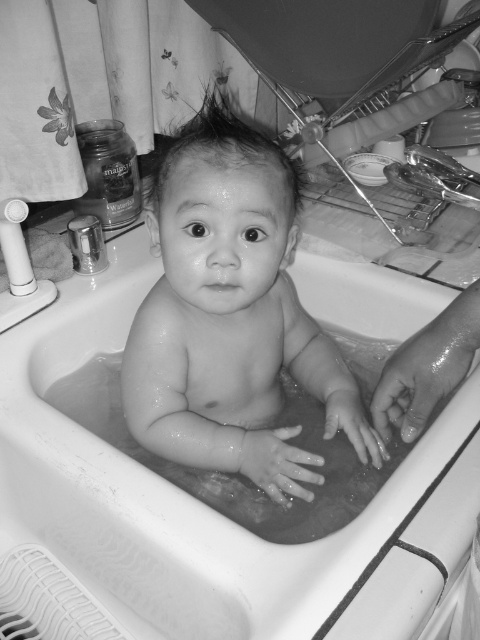
You are a caregiver trying to place the wet skin hand at center into the white smooth bathtub at center. Will the hand fit comfortably inside the bathtub?

The white smooth bathtub at center is wider than the wet skin hand at center, so the hand will fit comfortably inside the bathtub.